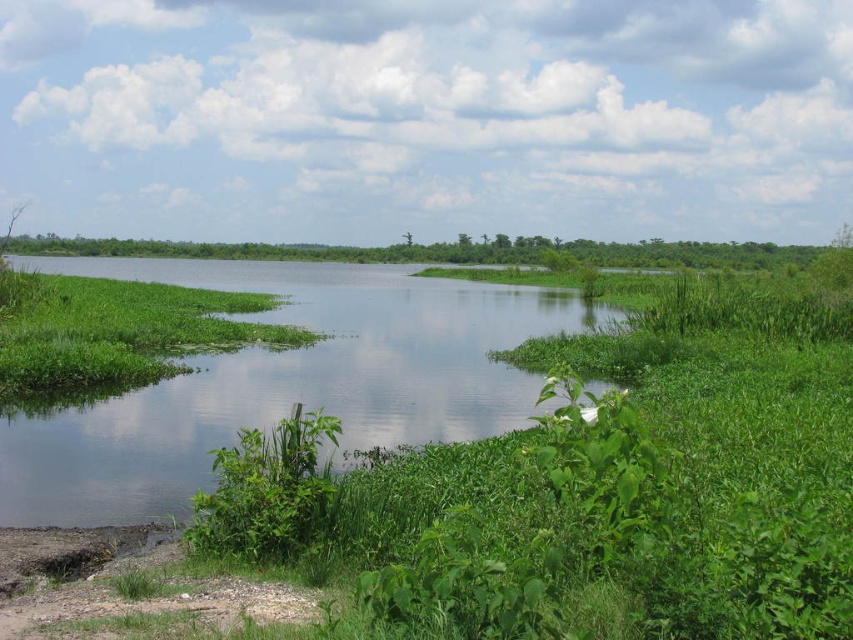
Based on the photo, you are standing at the edge of the green grassy land at center and want to cross to the other side. Which direction should you walk to reach the green grassy river at center?

You should walk to the left to reach the green grassy river at center since it is located to the left of the green grassy land at center.

You are standing at the edge of the lake and see two points marked in the image. Which point, point (285, 273) or point (213, 257), is closer to you?

Point (285, 273) is closer to the viewer than point (213, 257).